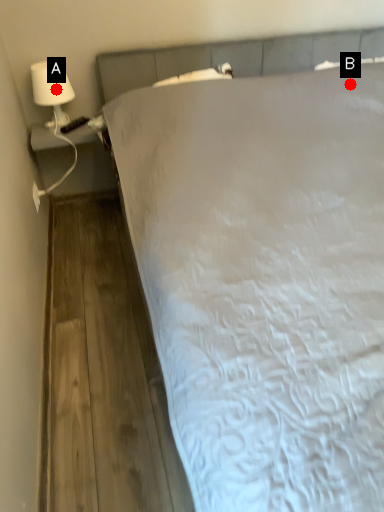
Question: Two points are circled on the image, labeled by A and B beside each circle. Which point appears closest to the camera in this image?

Choices:
 (A) A is closer
 (B) B is closer

Answer: (A)